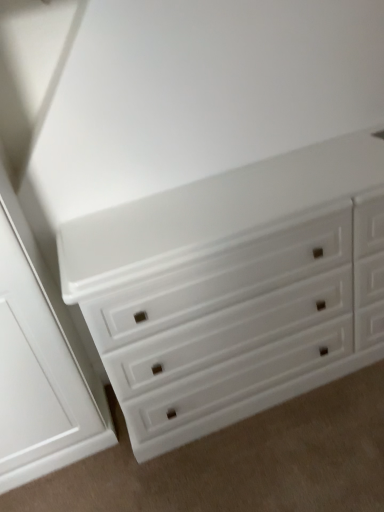
Image resolution: width=384 pixels, height=512 pixels. I want to click on white painted wood chest of drawers at center, so click(x=234, y=288).

From the picture: Measure the distance between point (177, 246) and camera.

They are 3.99 feet apart.

The image size is (384, 512). Describe the element at coordinates (234, 288) in the screenshot. I see `white painted wood chest of drawers at center` at that location.

The image size is (384, 512). In order to click on white painted wood chest of drawers at center in this screenshot , I will do `click(234, 288)`.